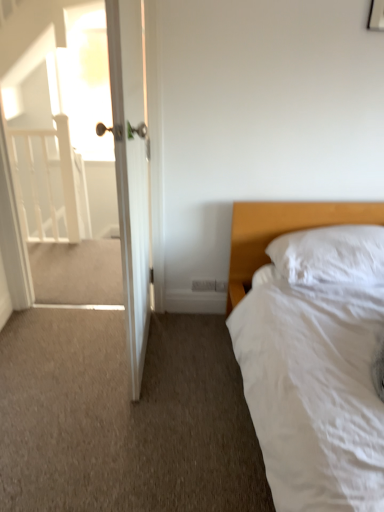
Question: From the image's perspective, is white wooden balustrade at left under white wooden door at left?

Choices:
 (A) yes
 (B) no

Answer: (B)

Question: Is white wooden balustrade at left oriented towards white wooden door at left?

Choices:
 (A) no
 (B) yes

Answer: (A)

Question: Can you confirm if white wooden balustrade at left is bigger than white wooden door at left?

Choices:
 (A) no
 (B) yes

Answer: (A)

Question: Does white wooden balustrade at left appear on the left side of white wooden door at left?

Choices:
 (A) yes
 (B) no

Answer: (A)

Question: Is white wooden door at left located within white wooden balustrade at left?

Choices:
 (A) no
 (B) yes

Answer: (A)

Question: Based on their positions, is white wooden door at left located to the left or right of white wooden balustrade at left?

Choices:
 (A) left
 (B) right

Answer: (B)

Question: Looking at their shapes, would you say white wooden door at left is wider or thinner than white wooden balustrade at left?

Choices:
 (A) thin
 (B) wide

Answer: (B)

Question: Considering their positions, is white wooden door at left located in front of or behind white wooden balustrade at left?

Choices:
 (A) front
 (B) behind

Answer: (A)

Question: Is white wooden door at left taller or shorter than white wooden balustrade at left?

Choices:
 (A) short
 (B) tall

Answer: (B)

Question: In terms of size, does white glossy door at upper left appear bigger or smaller than white wooden door at left?

Choices:
 (A) small
 (B) big

Answer: (A)

Question: Considering their positions, is white glossy door at upper left located in front of or behind white wooden door at left?

Choices:
 (A) behind
 (B) front

Answer: (A)

Question: Is point (8, 115) closer or farther from the camera than point (119, 7)?

Choices:
 (A) closer
 (B) farther

Answer: (B)

Question: Is white glossy door at upper left inside or outside of white wooden door at left?

Choices:
 (A) inside
 (B) outside

Answer: (B)

Question: Considering their positions, is white soft bed at right located in front of or behind white soft pillow at right?

Choices:
 (A) behind
 (B) front

Answer: (B)

Question: Is point (226, 309) closer or farther from the camera than point (382, 259)?

Choices:
 (A) farther
 (B) closer

Answer: (A)